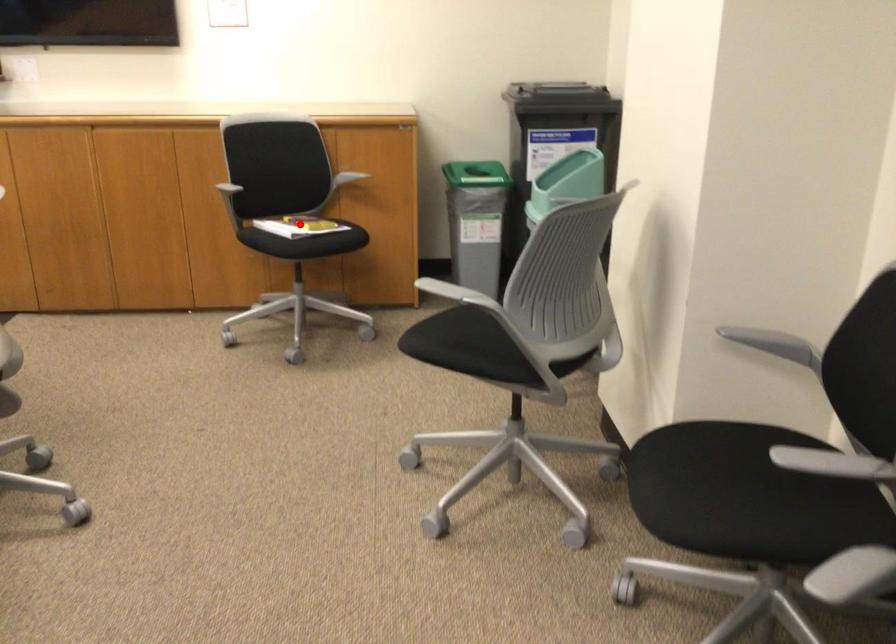
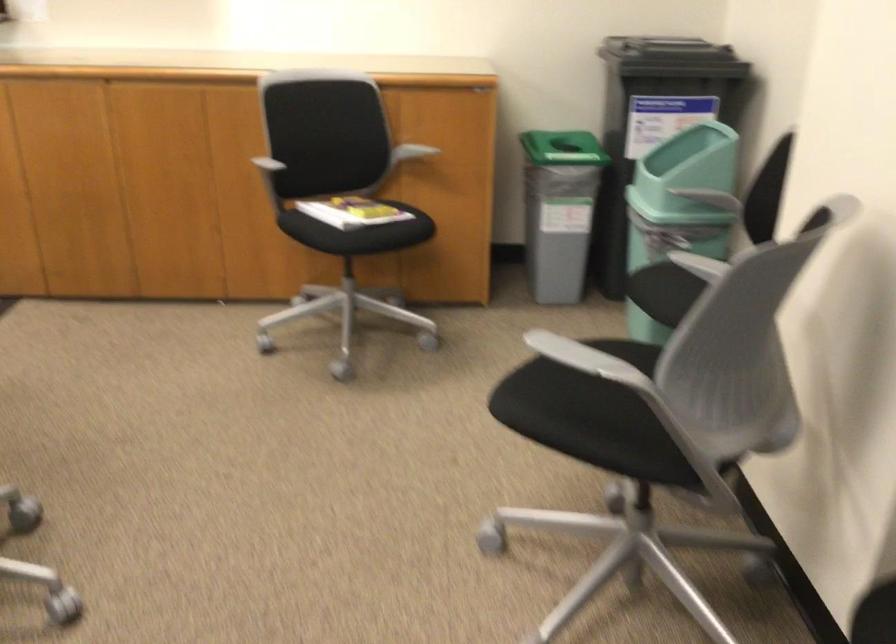
Question: I am providing you with two images of the same scene from different viewpoints. Image1 has a red point marked. In image2, the corresponding 3D location appears at what relative position? Reply with the corresponding letter.

Choices:
 (A) Closer
 (B) Farther

Answer: (A)